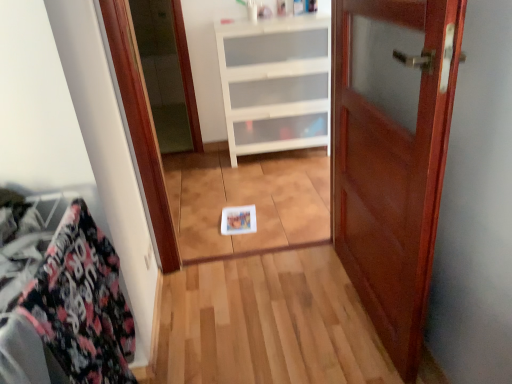
Question: Considering the positions of white plastic drawer at center and floral fabric at left in the image, is white plastic drawer at center taller or shorter than floral fabric at left?

Choices:
 (A) short
 (B) tall

Answer: (B)

Question: Looking at the image, does white plastic drawer at center seem bigger or smaller compared to floral fabric at left?

Choices:
 (A) big
 (B) small

Answer: (A)

Question: Estimate the real-world distances between objects in this image. Which object is closer to the floral fabric at left?

Choices:
 (A) mahogany wood door at center
 (B) white plastic drawer at center

Answer: (A)

Question: Based on their relative distances, which object is farther from the mahogany wood door at center?

Choices:
 (A) floral fabric at left
 (B) white plastic drawer at center

Answer: (B)